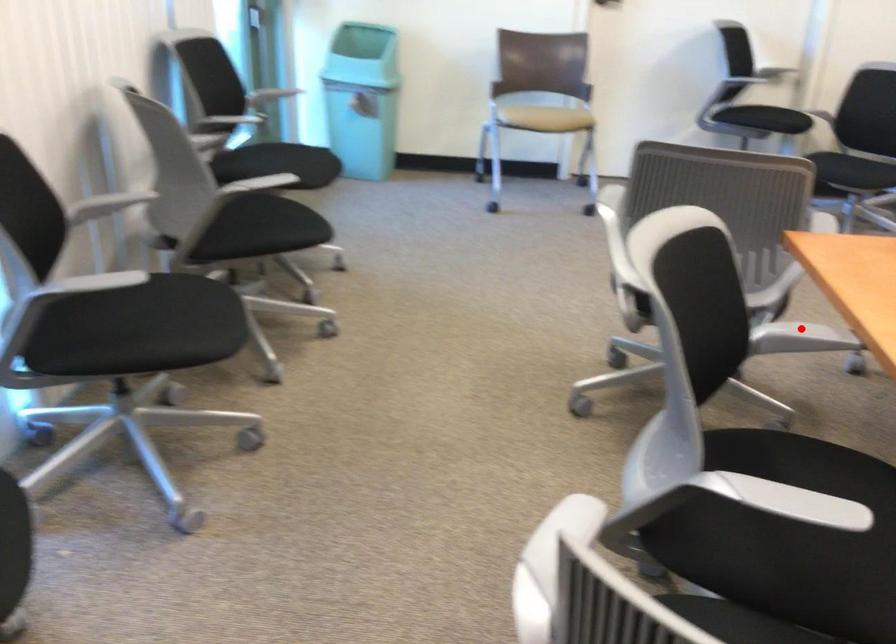
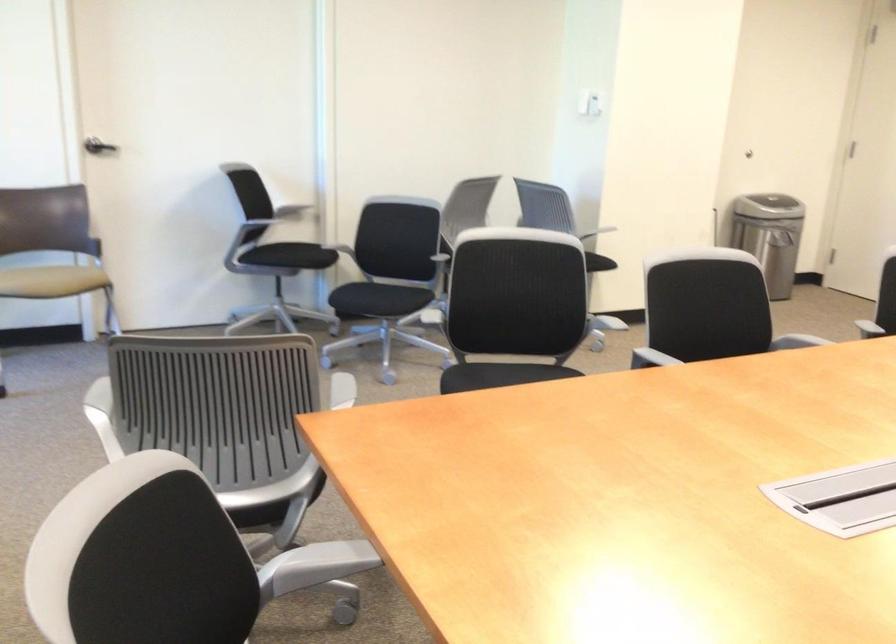
In the second image, find the point that corresponds to the highlighted location in the first image.

(320, 562)